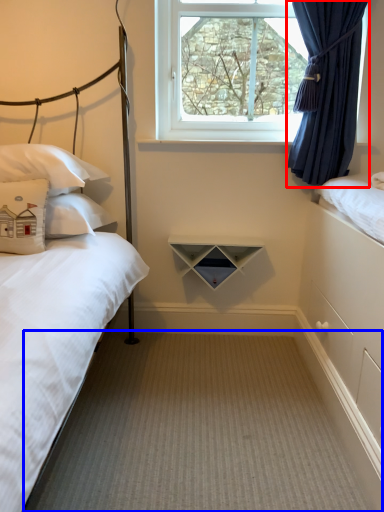
Question: Among these objects, which one is farthest to the camera, curtain (highlighted by a red box) or plain (highlighted by a blue box)?

Choices:
 (A) curtain
 (B) plain

Answer: (A)